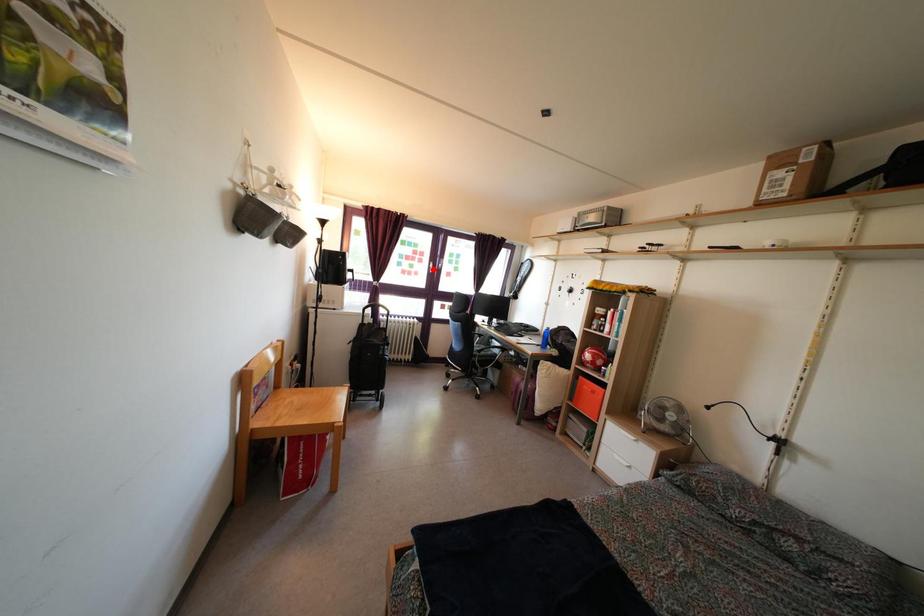
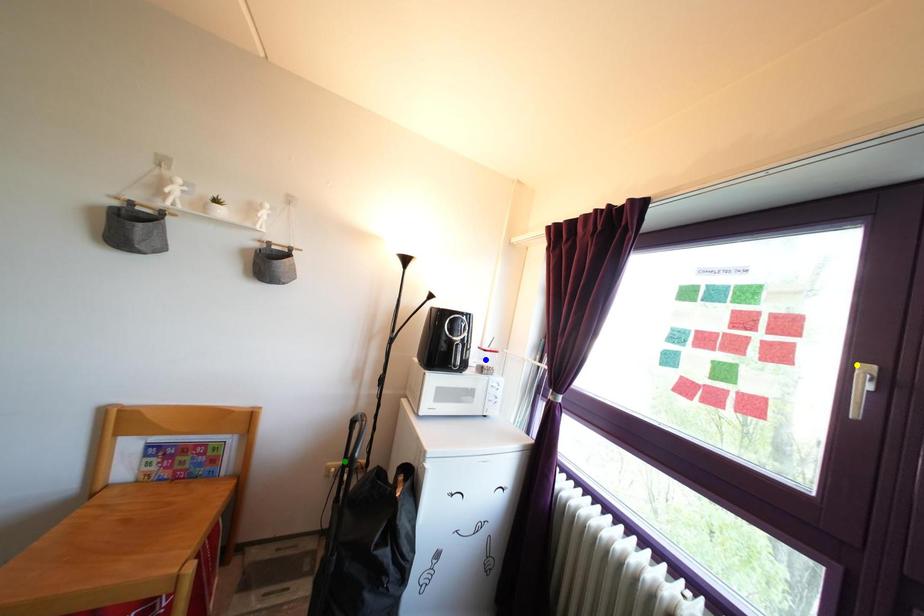
Question: I am providing you with two images of the same scene from different viewpoints. A red point is marked on the first image. You are given multiple points on the second image. Can you choose the point in image 2 that corresponds to the point in image 1?

Choices:
 (A) green point
 (B) blue point
 (C) yellow point

Answer: (C)